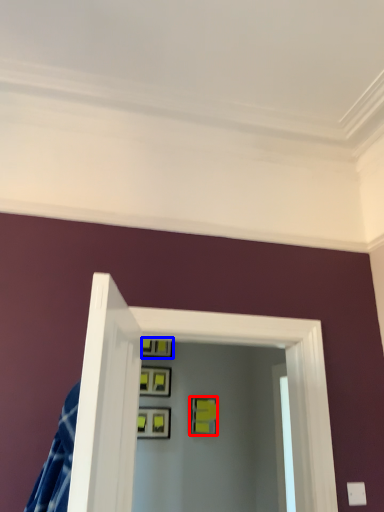
Question: Which object is closer to the camera taking this photo, picture frame (highlighted by a red box) or picture frame (highlighted by a blue box)?

Choices:
 (A) picture frame
 (B) picture frame

Answer: (A)